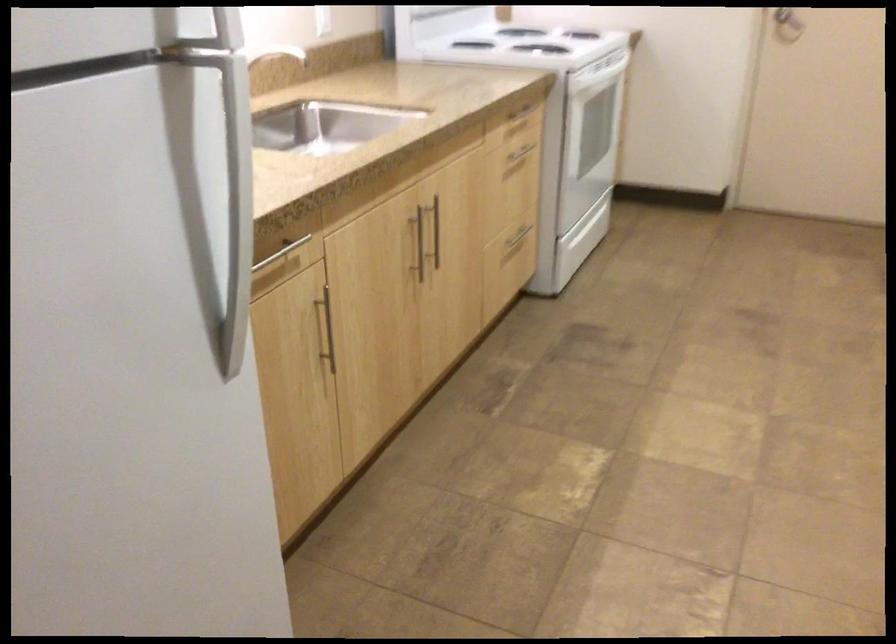
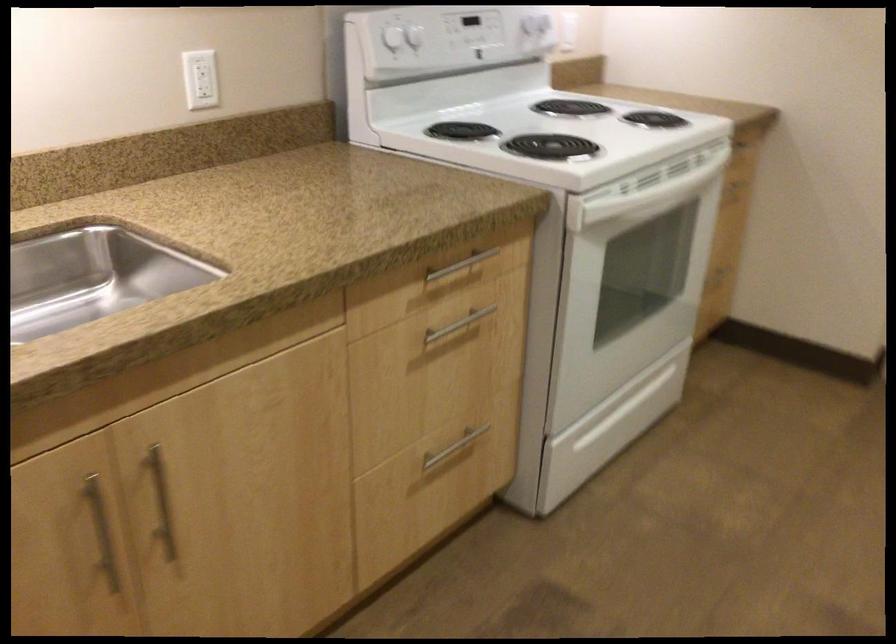
Find the pixel in the second image that matches point 519,238 in the first image.

(453, 448)